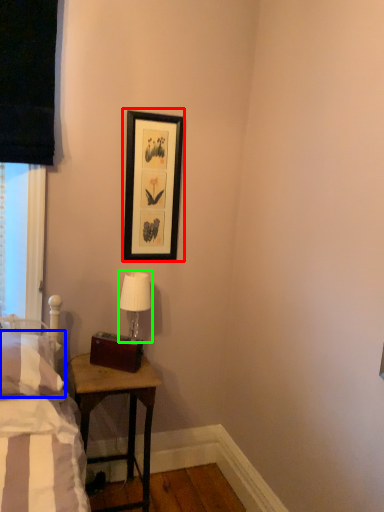
Question: Which is nearer to the picture frame (highlighted by a red box)? pillow (highlighted by a blue box) or table lamp (highlighted by a green box).

Choices:
 (A) pillow
 (B) table lamp

Answer: (B)